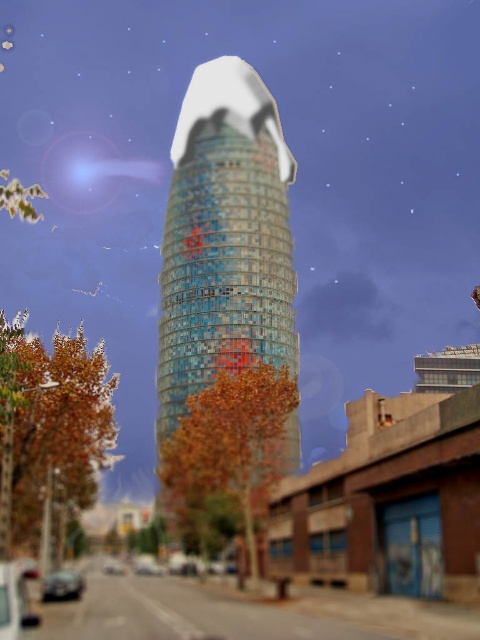
Looking at this image, you are a city planner analyzing the image. You need to determine if the multicolored glass tower at center can be safely constructed in the current street layout. Considering the street width, will the tower fit without encroaching on the shiny silver car at center? Please explain your reasoning.

The multicolored glass tower at center is wider than the shiny silver car at center. Since the tower is wider, it would likely encroach on the space occupied by the shiny silver car at center, making it unsuitable for the current street layout unless adjustments are made to either the tower dimensions or the street design.

You are standing on the street looking at the skyscraper. There are two points marked on the image. Which point, point [75,582] or point [112,570], is closer to you?

Point [75,582] is closer to the camera than point [112,570], so it is closer to you.

You are a pedestrian standing on the sidewalk and see both the shiny metallic car at lower left and the shiny silver car at lower left. Which car is positioned higher relative to the other?

The shiny metallic car at lower left is located above the shiny silver car at lower left, so it is positioned higher.